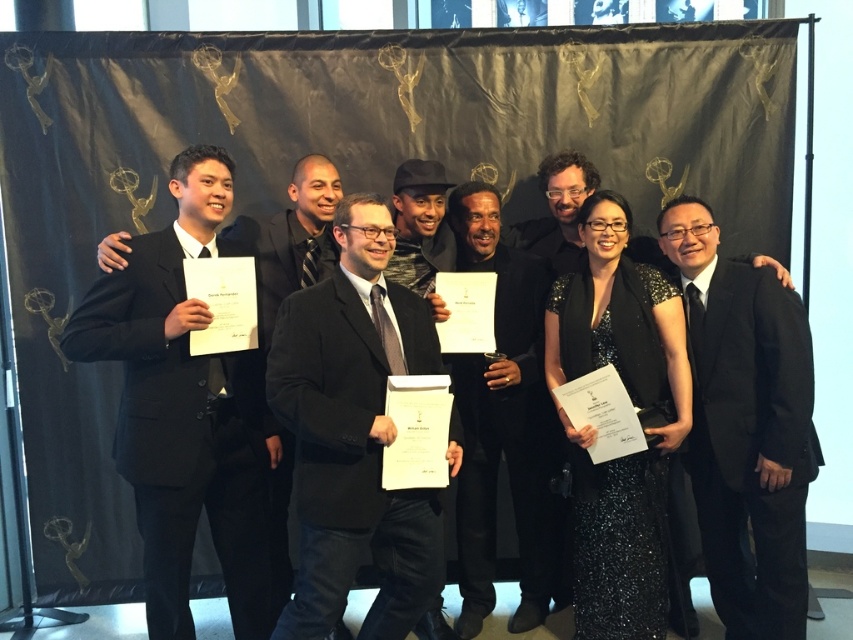
Question: In this image, where is matte black suit at center located relative to black textured hat at center?

Choices:
 (A) right
 (B) left

Answer: (B)

Question: Can you confirm if black matte suit at left is thinner than black textured hat at center?

Choices:
 (A) yes
 (B) no

Answer: (B)

Question: Estimate the real-world distances between objects in this image. Which object is farther from the black textured hat at center?

Choices:
 (A) black velvet suit at center
 (B) matte black suit at center
 (C) black suit at right

Answer: (C)

Question: Based on their relative distances, which object is farther from the black matte suit at left?

Choices:
 (A) black suit at right
 (B) black velvet suit at center
 (C) black textured hat at center
 (D) matte black suit at center

Answer: (A)

Question: Which of the following is the farthest from the observer?

Choices:
 (A) black velvet suit at center
 (B) matte black suit at center
 (C) black suit at right
 (D) black textured hat at center

Answer: (A)

Question: Where is matte black suit at center located in relation to black suit at right in the image?

Choices:
 (A) below
 (B) above

Answer: (B)